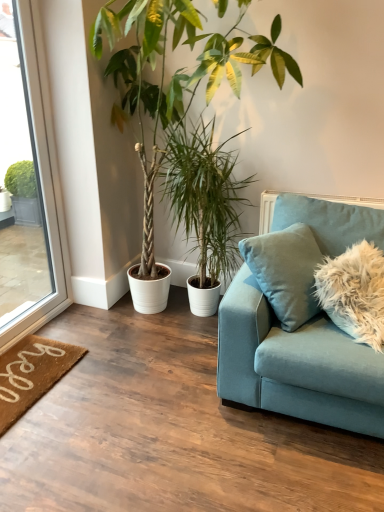
You are a GUI agent. You are given a task and a screenshot of the screen. Output one action in this format:
    pyautogui.click(x=<x>, y=<y>)
    Task: Click on the free space to the left of green leafy plant at center, the first houseplant positioned from the right
    The height and width of the screenshot is (512, 384).
    Given the screenshot: What is the action you would take?
    point(148,324)